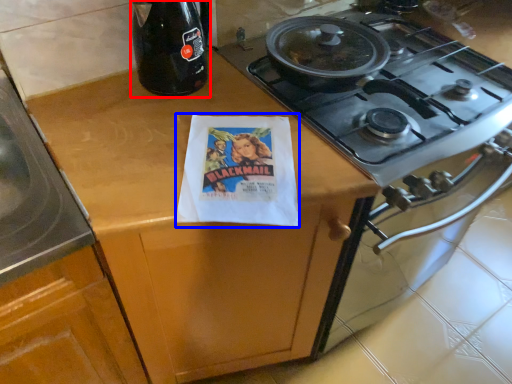
Question: Which object appears farthest to the camera in this image, bottle (highlighted by a red box) or flyer (highlighted by a blue box)?

Choices:
 (A) bottle
 (B) flyer

Answer: (A)